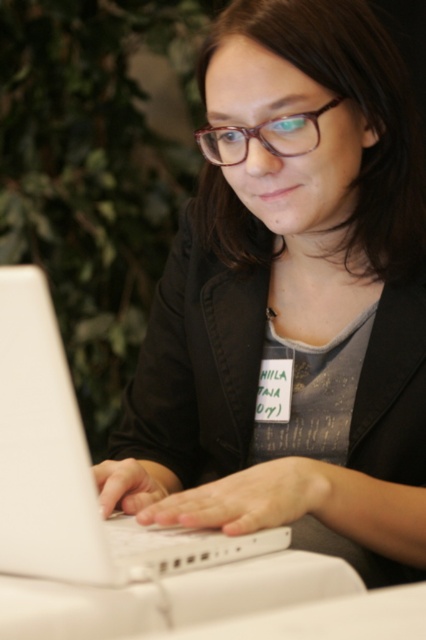
Is white matte laptop at center thinner than transparent plastic glasses at center?

No, white matte laptop at center is not thinner than transparent plastic glasses at center.

Is the position of white matte laptop at center more distant than that of transparent plastic glasses at center?

No, it is in front of transparent plastic glasses at center.

I want to click on white matte laptop at center, so click(x=74, y=468).

Can you confirm if matte black laptop at center is positioned to the right of transparent plastic glasses at center?

Incorrect, matte black laptop at center is not on the right side of transparent plastic glasses at center.

Is matte black laptop at center positioned in front of transparent plastic glasses at center?

Yes, matte black laptop at center is closer to the viewer.

Find the location of a particular element. This screenshot has width=426, height=640. matte black laptop at center is located at coordinates (291, 301).

Can you confirm if matte black laptop at center is positioned above white matte laptop at center?

Indeed, matte black laptop at center is positioned over white matte laptop at center.

Image resolution: width=426 pixels, height=640 pixels. What are the coordinates of `matte black laptop at center` in the screenshot? It's located at coord(291,301).

Who is more forward, (238, 397) or (161, 529)?

Point (161, 529) is more forward.

Where is `matte black laptop at center`? Image resolution: width=426 pixels, height=640 pixels. matte black laptop at center is located at coordinates [x=291, y=301].